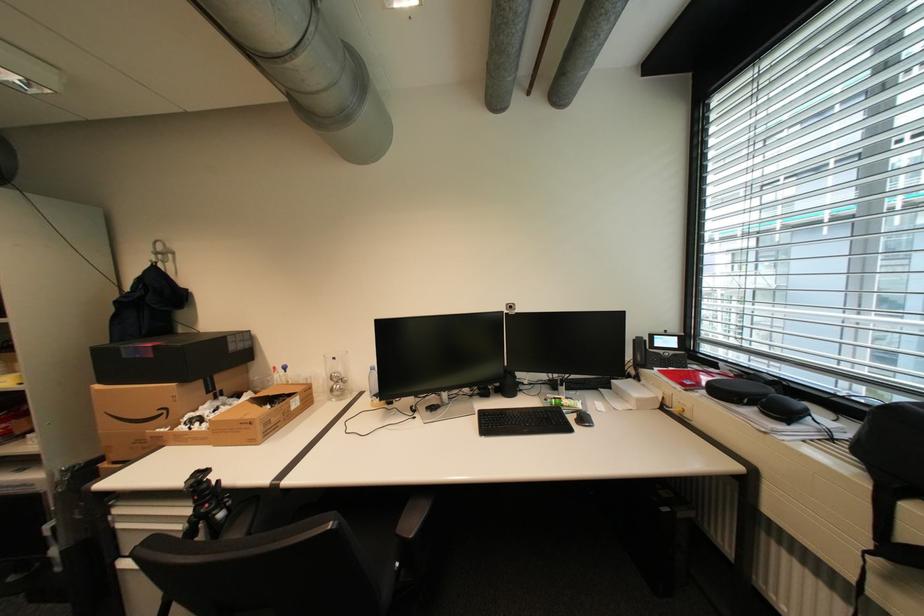
Image resolution: width=924 pixels, height=616 pixels. Find the location of `chair sitting surface`. chair sitting surface is located at coordinates (314, 508).